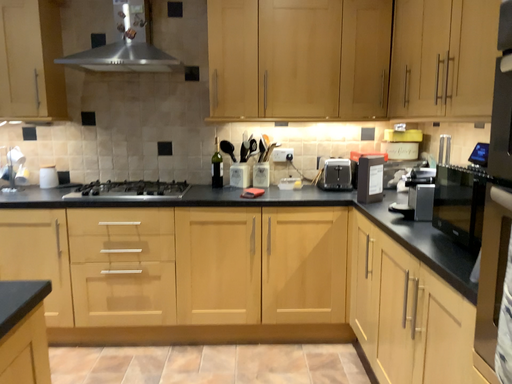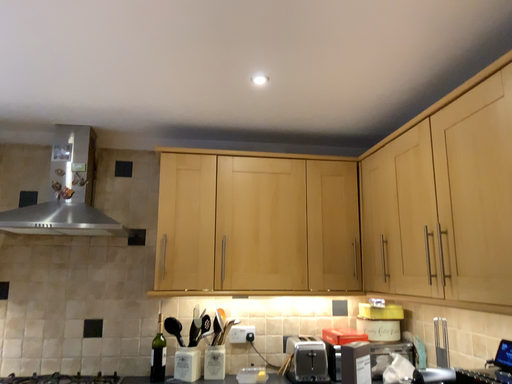
Question: How did the camera likely rotate when shooting the video?

Choices:
 (A) rotated left
 (B) rotated right

Answer: (B)